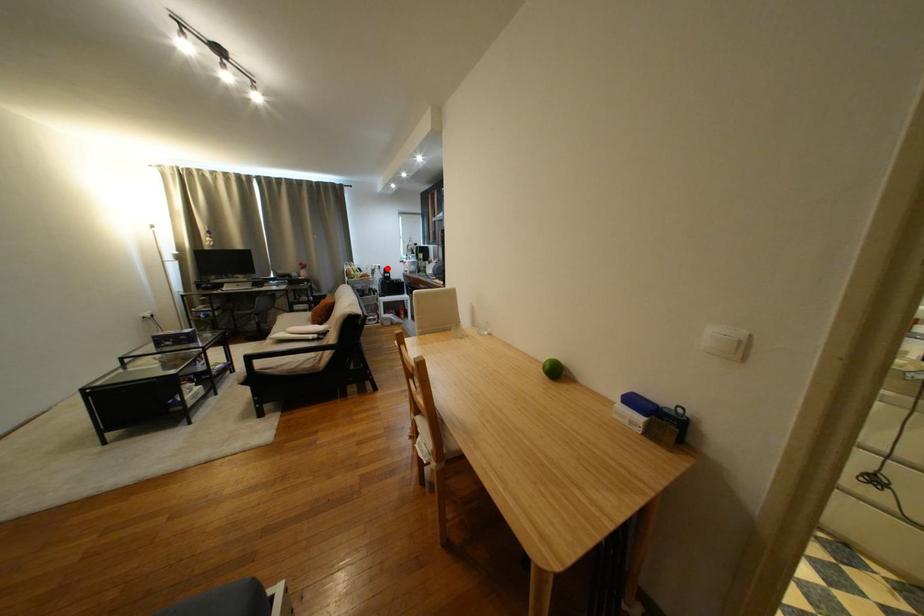
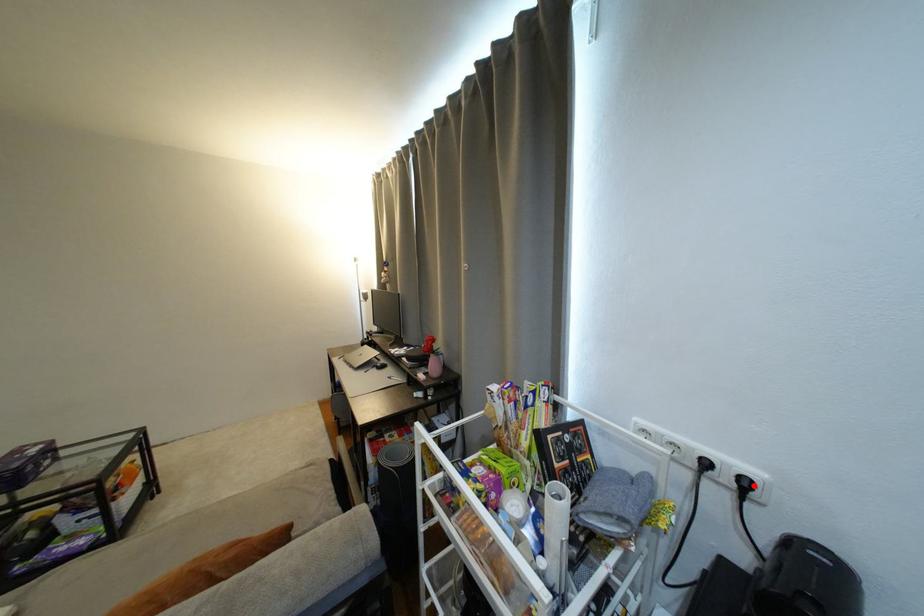
I am providing you with two images of the same scene from different viewpoints. A red point is marked on the first image and another point is marked on the second image. Are the points marked in image1 and image2 representing the same 3D position?

Yes